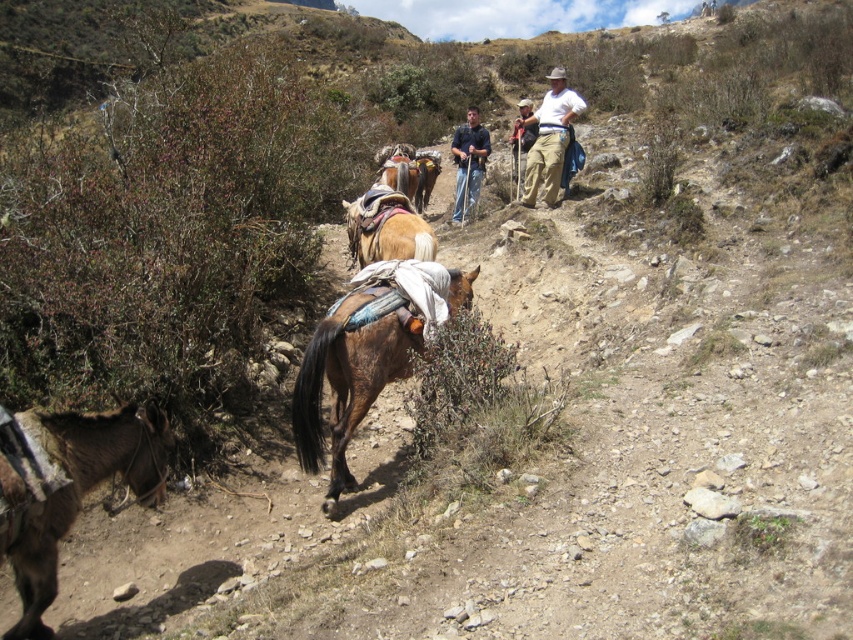
Between brown rough horse at center and khaki cotton pants at center, which one appears on the right side from the viewer's perspective?

khaki cotton pants at center is more to the right.

This screenshot has width=853, height=640. I want to click on brown rough horse at center, so click(345, 385).

Describe the element at coordinates (345, 385) in the screenshot. This screenshot has height=640, width=853. I see `brown rough horse at center` at that location.

Who is more forward, [376,364] or [422,228]?

Point [376,364]

Find the location of a particular element. This screenshot has width=853, height=640. brown rough horse at center is located at coordinates (345, 385).

Does point (351, 413) come behind point (474, 184)?

No, (351, 413) is closer to viewer.

Is brown rough horse at center shorter than blue jeans at center?

No, brown rough horse at center is not shorter than blue jeans at center.

Does point (318, 324) lie behind point (456, 186)?

That is False.

Identify the location of brown rough horse at center. The height and width of the screenshot is (640, 853). (345, 385).